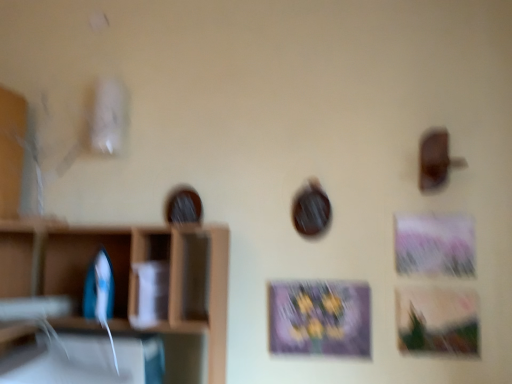
Question: From the image's perspective, is blue plastic iron at left on wooden shelf at left?

Choices:
 (A) no
 (B) yes

Answer: (B)

Question: Considering the relative sizes of blue plastic iron at left and wooden shelf at left in the image provided, is blue plastic iron at left wider than wooden shelf at left?

Choices:
 (A) yes
 (B) no

Answer: (B)

Question: Is blue plastic iron at left closer to camera compared to wooden shelf at left?

Choices:
 (A) yes
 (B) no

Answer: (B)

Question: Can you confirm if blue plastic iron at left is shorter than wooden shelf at left?

Choices:
 (A) yes
 (B) no

Answer: (A)

Question: Could you tell me if blue plastic iron at left is facing wooden shelf at left?

Choices:
 (A) no
 (B) yes

Answer: (B)

Question: From the image's perspective, is blue plastic iron at left above or below wooden shelf at left?

Choices:
 (A) above
 (B) below

Answer: (A)

Question: Considering the positions of blue plastic iron at left and wooden shelf at left in the image, is blue plastic iron at left taller or shorter than wooden shelf at left?

Choices:
 (A) short
 (B) tall

Answer: (A)

Question: Is blue plastic iron at left spatially inside wooden shelf at left, or outside of it?

Choices:
 (A) inside
 (B) outside

Answer: (A)

Question: Is point (90, 261) positioned closer to the camera than point (8, 109)?

Choices:
 (A) closer
 (B) farther

Answer: (A)

Question: In terms of width, does wooden shelf at left look wider or thinner when compared to blue plastic iron at left?

Choices:
 (A) wide
 (B) thin

Answer: (A)

Question: Considering the positions of wooden shelf at left and blue plastic iron at left in the image, is wooden shelf at left taller or shorter than blue plastic iron at left?

Choices:
 (A) short
 (B) tall

Answer: (B)

Question: Does point (170, 309) appear closer or farther from the camera than point (118, 236)?

Choices:
 (A) closer
 (B) farther

Answer: (A)

Question: Visually, is wooden shelf at left positioned to the left or to the right of blue plastic iron at left?

Choices:
 (A) right
 (B) left

Answer: (B)

Question: From a real-world perspective, is matte purple picture frame at center physically located above or below blue plastic iron at left?

Choices:
 (A) below
 (B) above

Answer: (A)

Question: Is point (309, 350) closer or farther from the camera than point (64, 233)?

Choices:
 (A) closer
 (B) farther

Answer: (A)